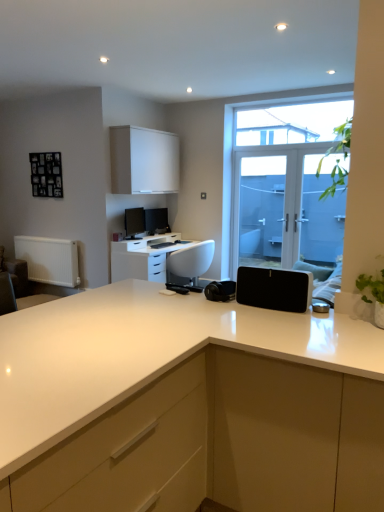
Question: From a real-world perspective, is black matte speaker at center on white glossy desk at center?

Choices:
 (A) no
 (B) yes

Answer: (B)

Question: Does black matte speaker at center have a lesser height compared to white glossy desk at center?

Choices:
 (A) no
 (B) yes

Answer: (B)

Question: From the image's perspective, is black matte speaker at center under white glossy desk at center?

Choices:
 (A) no
 (B) yes

Answer: (B)

Question: Can we say black matte speaker at center lies outside white glossy desk at center?

Choices:
 (A) yes
 (B) no

Answer: (A)

Question: Is black matte speaker at center further to the viewer compared to white glossy desk at center?

Choices:
 (A) yes
 (B) no

Answer: (B)

Question: In the image, is white glossy countertop at center positioned in front of or behind transparent glass door at center?

Choices:
 (A) front
 (B) behind

Answer: (A)

Question: From their relative heights in the image, would you say white glossy countertop at center is taller or shorter than transparent glass door at center?

Choices:
 (A) tall
 (B) short

Answer: (B)

Question: Looking at their shapes, would you say white glossy countertop at center is wider or thinner than transparent glass door at center?

Choices:
 (A) wide
 (B) thin

Answer: (A)

Question: Considering the positions of point (44, 505) and point (283, 96), is point (44, 505) closer or farther from the camera than point (283, 96)?

Choices:
 (A) closer
 (B) farther

Answer: (A)

Question: Is white glossy desk at center spatially inside matte white cabinet at center, acting as the first cabinetry starting from the bottom, or outside of it?

Choices:
 (A) outside
 (B) inside

Answer: (A)

Question: Considering the positions of white glossy desk at center and matte white cabinet at center, acting as the first cabinetry starting from the bottom, in the image, is white glossy desk at center bigger or smaller than matte white cabinet at center, acting as the first cabinetry starting from the bottom,?

Choices:
 (A) big
 (B) small

Answer: (A)

Question: Is point (137, 259) positioned closer to the camera than point (231, 478)?

Choices:
 (A) closer
 (B) farther

Answer: (B)

Question: In terms of height, does white glossy desk at center look taller or shorter compared to matte white cabinet at center, which is the second cabinetry in left-to-right order?

Choices:
 (A) short
 (B) tall

Answer: (A)

Question: From the image's perspective, relative to white glossy countertop at center, is matte black monitor at center, acting as the second computer monitor starting from the front, above or below?

Choices:
 (A) above
 (B) below

Answer: (A)

Question: Does point (165, 229) appear closer or farther from the camera than point (360, 457)?

Choices:
 (A) closer
 (B) farther

Answer: (B)